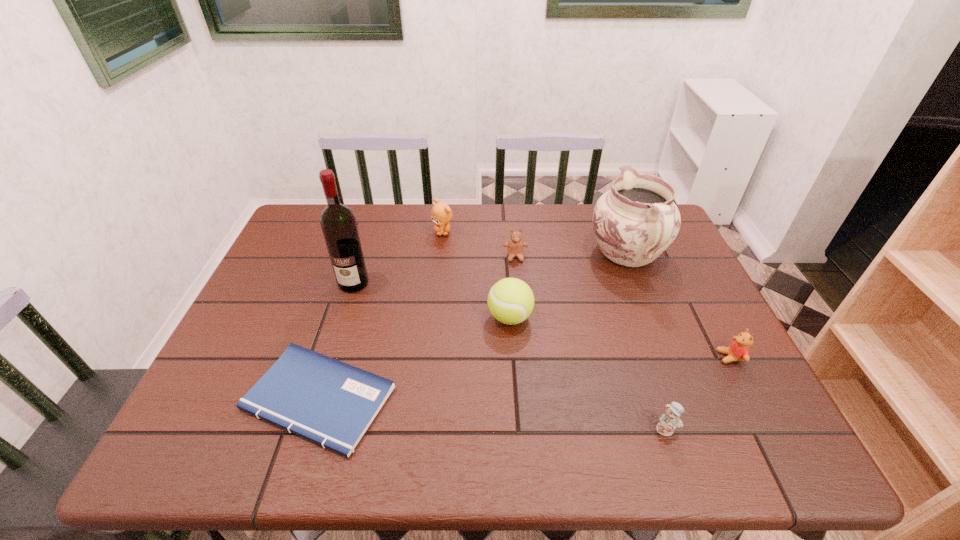
This screenshot has width=960, height=540. I want to click on vacant region between the third object from left to right and the rightmost teddy bear, so click(587, 294).

Where is `unoccupied position between the tallest object and the paperback book`? unoccupied position between the tallest object and the paperback book is located at coordinates (336, 341).

Locate which object ranks seventh in proximity to the rightmost teddy bear. Please provide its 2D coordinates. Your answer should be formatted as a tuple, i.e. [(x, y)], where the tuple contains the x and y coordinates of a point satisfying the conditions above.

[(338, 222)]

Locate which object ranks sixth in proximity to the third nearest teddy bear. Please provide its 2D coordinates. Your answer should be formatted as a tuple, i.e. [(x, y)], where the tuple contains the x and y coordinates of a point satisfying the conditions above.

[(738, 350)]

Locate an element on the screen. teddy bear that stands as the second closest to the leftmost teddy bear is located at coordinates (669, 421).

Identify which teddy bear is the second nearest to the alcohol. Please provide its 2D coordinates. Your answer should be formatted as a tuple, i.e. [(x, y)], where the tuple contains the x and y coordinates of a point satisfying the conditions above.

[(515, 246)]

Identify the location of free spot that satisfies the following two spatial constraints: 1. on the front and back of the alcohol; 2. on the left side of the fifth farthest object. This screenshot has width=960, height=540. (343, 317).